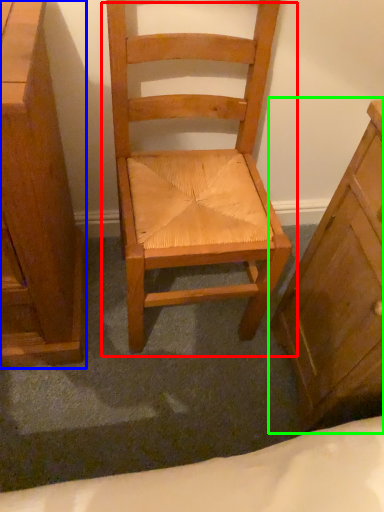
Question: Which object is positioned farthest from chair (highlighted by a red box)? Select from chest of drawers (highlighted by a blue box) and chest of drawers (highlighted by a green box).

Choices:
 (A) chest of drawers
 (B) chest of drawers

Answer: (A)